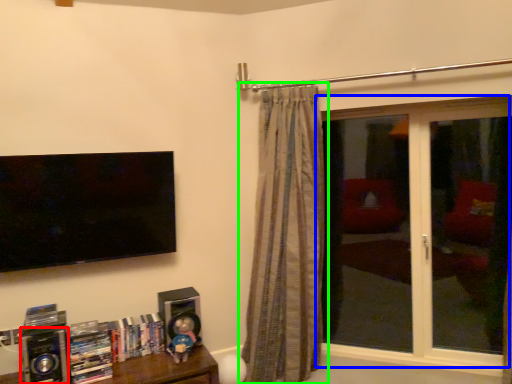
Question: Estimate the real-world distances between objects in this image. Which object is farther from speaker (highlighted by a red box), window (highlighted by a blue box) or curtain (highlighted by a green box)?

Choices:
 (A) window
 (B) curtain

Answer: (A)